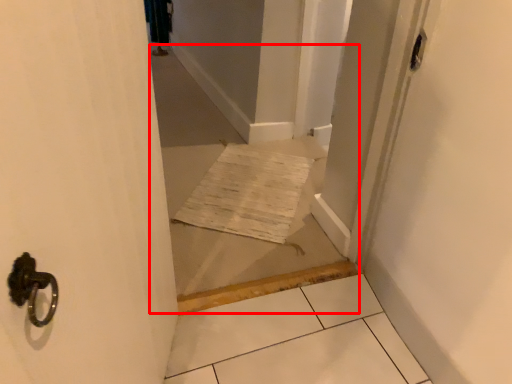
Question: From the image's perspective, considering the relative positions of corridor (annotated by the red box) and screen door in the image provided, where is corridor (annotated by the red box) located with respect to the staircase?

Choices:
 (A) below
 (B) above

Answer: (B)